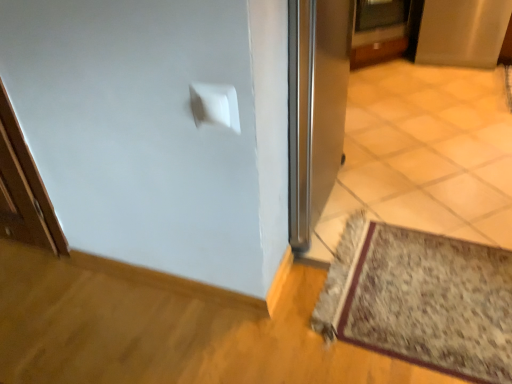
Question: Does satin silver screen door at upper right have a smaller size compared to metallic silver door at upper center?

Choices:
 (A) no
 (B) yes

Answer: (A)

Question: Is satin silver screen door at upper right bigger than metallic silver door at upper center?

Choices:
 (A) no
 (B) yes

Answer: (B)

Question: Does satin silver screen door at upper right have a greater width compared to metallic silver door at upper center?

Choices:
 (A) yes
 (B) no

Answer: (A)

Question: Considering the relative sizes of satin silver screen door at upper right and metallic silver door at upper center in the image provided, is satin silver screen door at upper right thinner than metallic silver door at upper center?

Choices:
 (A) yes
 (B) no

Answer: (B)

Question: Is the surface of satin silver screen door at upper right in direct contact with metallic silver door at upper center?

Choices:
 (A) no
 (B) yes

Answer: (A)

Question: Does satin silver screen door at upper right have a greater height compared to metallic silver door at upper center?

Choices:
 (A) yes
 (B) no

Answer: (A)

Question: Are metallic silver door at upper center and satin silver screen door at upper right located far from each other?

Choices:
 (A) no
 (B) yes

Answer: (A)

Question: Can you confirm if metallic silver door at upper center is bigger than satin silver screen door at upper right?

Choices:
 (A) no
 (B) yes

Answer: (A)

Question: From the image's perspective, does metallic silver door at upper center appear lower than satin silver screen door at upper right?

Choices:
 (A) no
 (B) yes

Answer: (A)

Question: Is metallic silver door at upper center at the right side of satin silver screen door at upper right?

Choices:
 (A) yes
 (B) no

Answer: (B)

Question: Considering the relative positions of metallic silver door at upper center and satin silver screen door at upper right in the image provided, is metallic silver door at upper center to the left of satin silver screen door at upper right from the viewer's perspective?

Choices:
 (A) no
 (B) yes

Answer: (B)

Question: Does metallic silver door at upper center have a smaller size compared to satin silver screen door at upper right?

Choices:
 (A) yes
 (B) no

Answer: (A)

Question: Can you confirm if floral carpet at lower right is taller than metallic silver door at upper center?

Choices:
 (A) no
 (B) yes

Answer: (A)